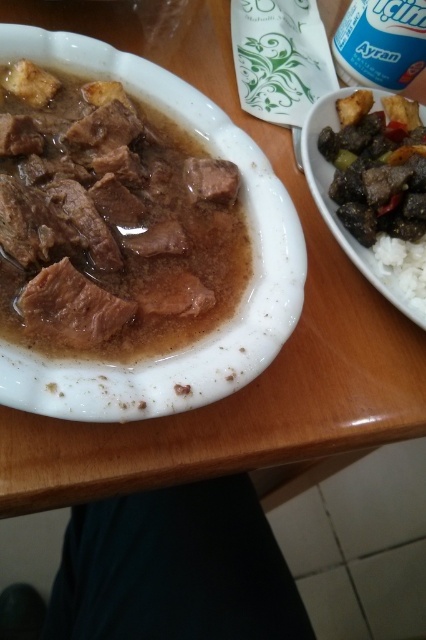
Does brown glossy meat at upper right have a larger size compared to white creamy yogurt at upper right?

Correct, brown glossy meat at upper right is larger in size than white creamy yogurt at upper right.

Is brown glossy meat at upper right closer to the viewer compared to white creamy yogurt at upper right?

That is True.

Locate an element on the screen. This screenshot has height=640, width=426. brown glossy meat at upper right is located at coordinates (377, 166).

You are a GUI agent. You are given a task and a screenshot of the screen. Output one action in this format:
    pyautogui.click(x=<x>, y=<y>)
    Task: Click on the brown glossy meat at upper right
    The height and width of the screenshot is (640, 426).
    Given the screenshot: What is the action you would take?
    pyautogui.click(x=377, y=166)

Who is taller, brown glossy meat at left or brown glossy meat at upper right?

Standing taller between the two is brown glossy meat at left.

Which is more to the right, brown glossy meat at left or brown glossy meat at upper right?

brown glossy meat at upper right

Find the location of a particular element. This screenshot has height=640, width=426. brown glossy meat at left is located at coordinates (109, 221).

Is brown glossy meat at left to the right of white creamy yogurt at upper right from the viewer's perspective?

No, brown glossy meat at left is not to the right of white creamy yogurt at upper right.

Can you confirm if brown glossy meat at left is positioned to the left of white creamy yogurt at upper right?

Correct, you'll find brown glossy meat at left to the left of white creamy yogurt at upper right.

Image resolution: width=426 pixels, height=640 pixels. What do you see at coordinates (109, 221) in the screenshot?
I see `brown glossy meat at left` at bounding box center [109, 221].

Where is `brown glossy meat at left`? The image size is (426, 640). brown glossy meat at left is located at coordinates (109, 221).